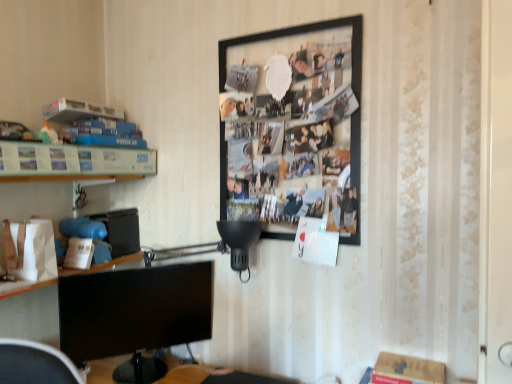
What do you see at coordinates (73, 160) in the screenshot?
I see `metallic silver frame at left` at bounding box center [73, 160].

I want to click on black glossy monitor at lower left, so click(135, 309).

From the image's perspective, is black glossy monitor at lower left located above or below black matte picture frame at upper center?

From the image's perspective, black glossy monitor at lower left appears below black matte picture frame at upper center.

Is black glossy monitor at lower left spatially inside black matte picture frame at upper center, or outside of it?

black glossy monitor at lower left exists outside the volume of black matte picture frame at upper center.

This screenshot has width=512, height=384. I want to click on computer monitor located on the left of black matte picture frame at upper center, so click(135, 309).

Does black glossy monitor at lower left have a greater height compared to black matte picture frame at upper center?

In fact, black glossy monitor at lower left may be shorter than black matte picture frame at upper center.

Which point is more distant from viewer, (125, 327) or (135, 171)?

The point (135, 171) is farther.

Does black glossy monitor at lower left contain metallic silver frame at left?

No, metallic silver frame at left is not inside black glossy monitor at lower left.

Is black glossy monitor at lower left taller than metallic silver frame at left?

Yes, black glossy monitor at lower left is taller than metallic silver frame at left.

Considering their positions, is black glossy monitor at lower left located in front of or behind metallic silver frame at left?

In the image, black glossy monitor at lower left appears behind metallic silver frame at left.

Is metallic silver frame at left oriented towards black glossy monitor at lower left?

No, metallic silver frame at left is not facing towards black glossy monitor at lower left.

In the scene shown: Which object is further away from the camera taking this photo, metallic silver frame at left or black glossy monitor at lower left?

black glossy monitor at lower left is further from the camera.

From a real-world perspective, is metallic silver frame at left located beneath black glossy monitor at lower left?

No.

Considering the positions of points (127, 156) and (165, 284), is point (127, 156) farther from camera compared to point (165, 284)?

Yes, it is behind point (165, 284).

From the picture: From a real-world perspective, who is located lower, black matte picture frame at upper center or metallic silver frame at left?

metallic silver frame at left, from a real-world perspective.

Consider the image. Which is in front, black matte picture frame at upper center or metallic silver frame at left?

metallic silver frame at left is more forward.

How far apart are black matte picture frame at upper center and metallic silver frame at left?

black matte picture frame at upper center and metallic silver frame at left are 24.38 inches apart.

Which of these two, black matte picture frame at upper center or metallic silver frame at left, stands shorter?

With less height is metallic silver frame at left.

From a real-world perspective, is metallic silver frame at left physically located above or below black matte picture frame at upper center?

In terms of real-world spatial position, metallic silver frame at left is below black matte picture frame at upper center.

Is metallic silver frame at left oriented away from black matte picture frame at upper center?

No, metallic silver frame at left is not facing the opposite direction of black matte picture frame at upper center.

Considering the relative sizes of metallic silver frame at left and black matte picture frame at upper center in the image provided, is metallic silver frame at left taller than black matte picture frame at upper center?

Incorrect, the height of metallic silver frame at left is not larger of that of black matte picture frame at upper center.

Who is smaller, black matte picture frame at upper center or black glossy monitor at lower left?

black glossy monitor at lower left.

Is point (312, 89) farther from camera compared to point (144, 312)?

No, it is not.

Is black matte picture frame at upper center facing away from black glossy monitor at lower left?

No, black matte picture frame at upper center is not facing the opposite direction of black glossy monitor at lower left.

How different are the orientations of black matte picture frame at upper center and black glossy monitor at lower left in degrees?

52.6 degrees.

Where is `computer monitor below the black matte picture frame at upper center (from the image's perspective)`? The image size is (512, 384). computer monitor below the black matte picture frame at upper center (from the image's perspective) is located at coordinates (135, 309).

You are a GUI agent. You are given a task and a screenshot of the screen. Output one action in this format:
    pyautogui.click(x=<x>, y=<y>)
    Task: Click on the shelf located above the black glossy monitor at lower left (from a real-world perspective)
    Image resolution: width=512 pixels, height=384 pixels.
    Given the screenshot: What is the action you would take?
    pyautogui.click(x=73, y=160)

From the image, which object appears to be farther from black matte picture frame at upper center, black glossy monitor at lower left or metallic silver frame at left?

metallic silver frame at left.

Which object lies nearer to the anchor point metallic silver frame at left, black matte picture frame at upper center or black glossy monitor at lower left?

Among the two, black glossy monitor at lower left is located nearer to metallic silver frame at left.

From the image, which object appears to be nearer to black matte picture frame at upper center, metallic silver frame at left or black glossy monitor at lower left?

Based on the image, black glossy monitor at lower left appears to be nearer to black matte picture frame at upper center.

Based on their spatial positions, is black glossy monitor at lower left or black matte picture frame at upper center further from metallic silver frame at left?

black matte picture frame at upper center is further to metallic silver frame at left.

From the image, which object appears to be nearer to black glossy monitor at lower left, metallic silver frame at left or black matte picture frame at upper center?

metallic silver frame at left lies closer to black glossy monitor at lower left than the other object.

Considering their positions, is black matte picture frame at upper center positioned further to black glossy monitor at lower left than metallic silver frame at left?

Among the two, black matte picture frame at upper center is located further to black glossy monitor at lower left.

The width and height of the screenshot is (512, 384). I want to click on computer monitor situated between metallic silver frame at left and black matte picture frame at upper center from left to right, so click(x=135, y=309).